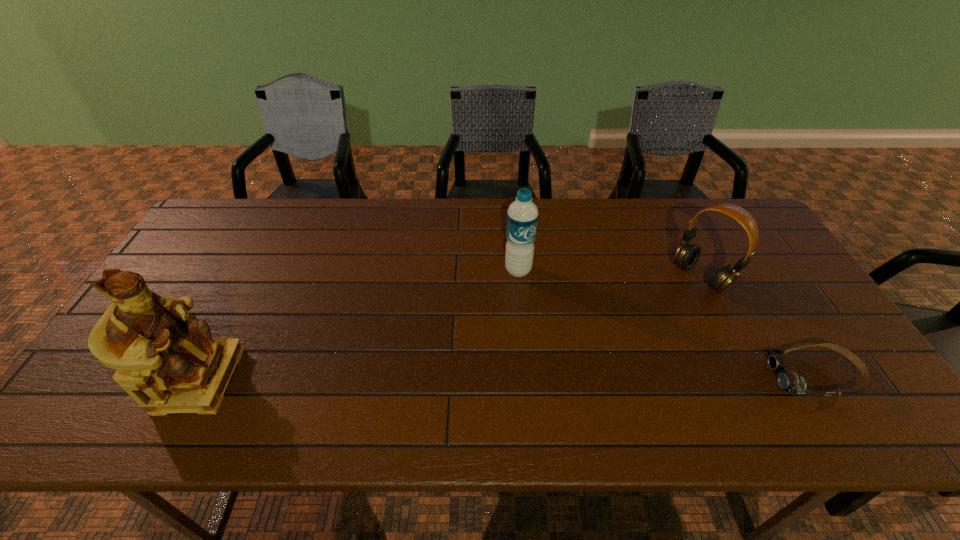
Locate an element on the screen. The height and width of the screenshot is (540, 960). the leftmost object is located at coordinates (166, 359).

Where is `the tallest object`? The width and height of the screenshot is (960, 540). the tallest object is located at coordinates (166, 359).

The height and width of the screenshot is (540, 960). In order to click on goggles in this screenshot , I will do `click(790, 382)`.

Locate an element on the screen. Image resolution: width=960 pixels, height=540 pixels. water bottle is located at coordinates (522, 215).

Locate an element on the screen. The height and width of the screenshot is (540, 960). the second tallest object is located at coordinates (522, 215).

Image resolution: width=960 pixels, height=540 pixels. In order to click on the third tallest object in this screenshot , I will do `click(687, 255)`.

At what (x,y) coordinates should I click in order to perform the action: click on free space located on the front-facing side of the tallest object. Please return your answer as a coordinate pair (x, y). This screenshot has width=960, height=540. Looking at the image, I should click on (394, 380).

Identify the location of free space located on the front-facing side of the goggles. (694, 376).

The height and width of the screenshot is (540, 960). In order to click on blank space located 0.270m on the front-facing side of the goggles in this screenshot , I will do `click(660, 376)`.

Locate an element on the screen. vacant space located on the front-facing side of the goggles is located at coordinates (681, 376).